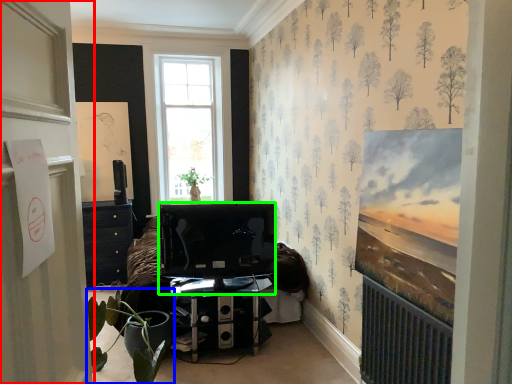
Question: Estimate the real-world distances between objects in this image. Which object is closer to door (highlighted by a red box), houseplant (highlighted by a blue box) or television (highlighted by a green box)?

Choices:
 (A) houseplant
 (B) television

Answer: (A)